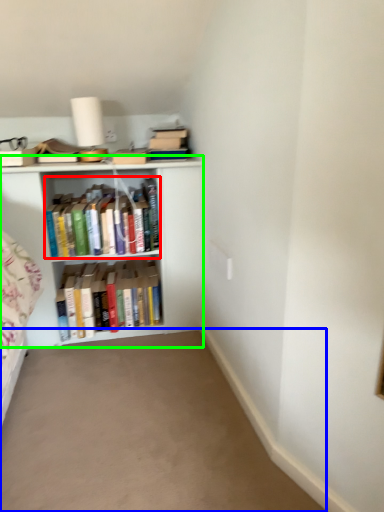
Question: Which is nearer to the book (highlighted by a red box)? plain (highlighted by a blue box) or shelf (highlighted by a green box).

Choices:
 (A) plain
 (B) shelf

Answer: (B)